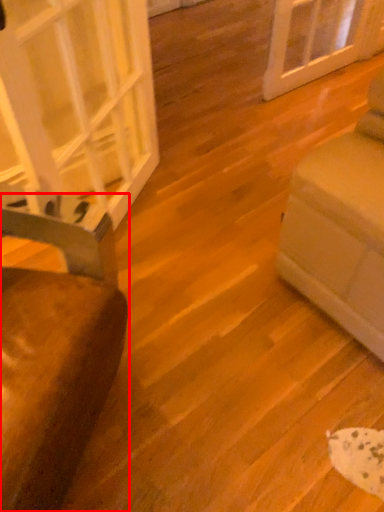
Question: Observing the image, what is the correct spatial positioning of furniture (annotated by the red box) in reference to glass door?

Choices:
 (A) right
 (B) left

Answer: (B)